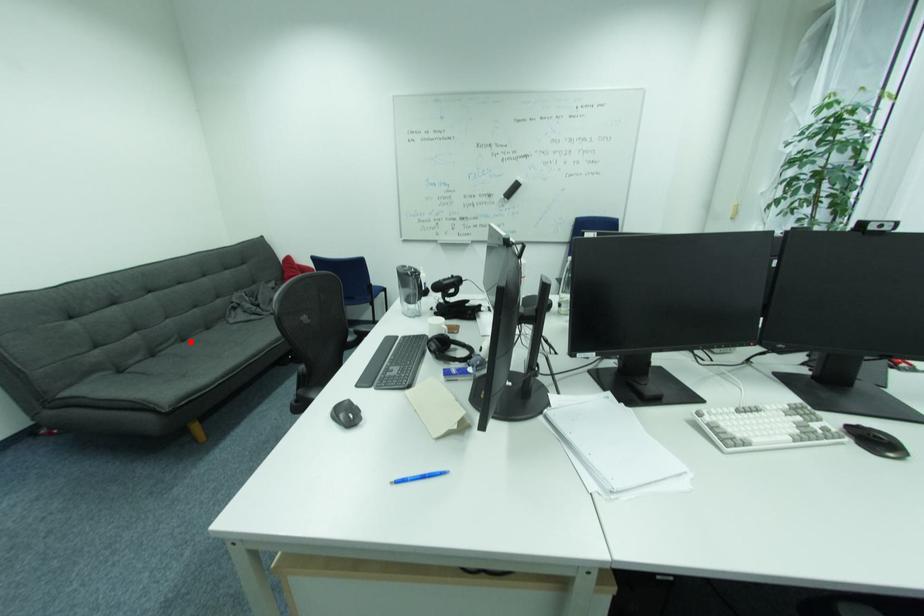
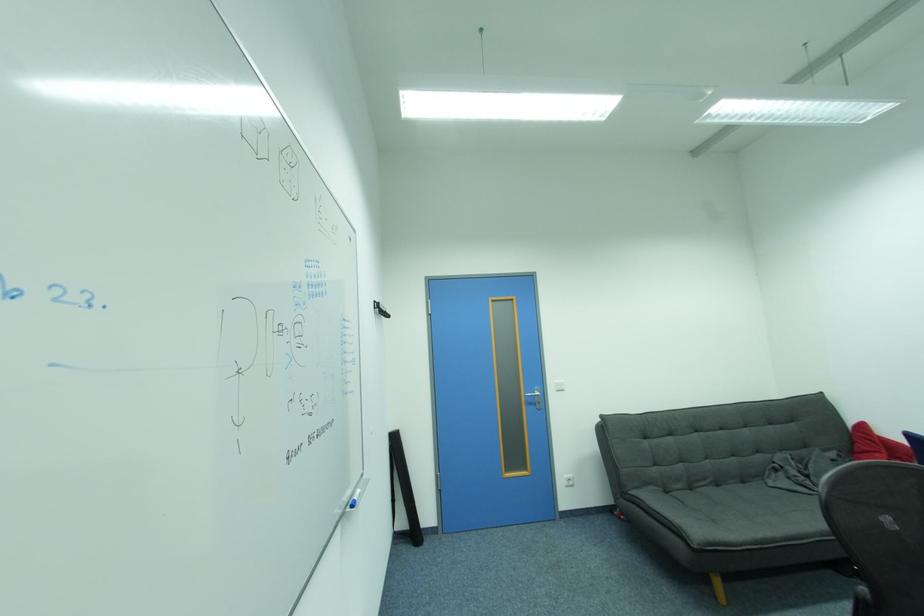
Locate, in the second image, the point that corresponds to the highlighted location in the first image.

(723, 487)